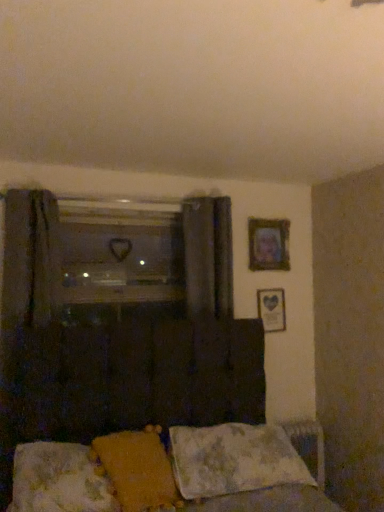
Question: Does yellow fabric pillow at lower center, marked as the 2th pillow in a right-to-left arrangement, have a greater width compared to fluffy white pillow at lower center, which ranks as the 1th pillow in left-to-right order?

Choices:
 (A) no
 (B) yes

Answer: (B)

Question: Does yellow fabric pillow at lower center, placed as the second pillow when sorted from left to right, have a lesser height compared to fluffy white pillow at lower center, which ranks as the 1th pillow in left-to-right order?

Choices:
 (A) no
 (B) yes

Answer: (A)

Question: Is yellow fabric pillow at lower center, marked as the 2th pillow in a right-to-left arrangement, positioned behind fluffy white pillow at lower center, which ranks as the 1th pillow in left-to-right order?

Choices:
 (A) yes
 (B) no

Answer: (A)

Question: Is yellow fabric pillow at lower center, marked as the 2th pillow in a right-to-left arrangement, to the right of fluffy white pillow at lower center, which ranks as the 1th pillow in left-to-right order, from the viewer's perspective?

Choices:
 (A) yes
 (B) no

Answer: (A)

Question: From the image's perspective, does yellow fabric pillow at lower center, placed as the second pillow when sorted from left to right, appear higher than fluffy white pillow at lower center, which ranks as the 3th pillow in right-to-left order?

Choices:
 (A) yes
 (B) no

Answer: (A)

Question: From the image's perspective, is yellow fabric pillow at lower center, placed as the second pillow when sorted from left to right, under fluffy white pillow at lower center, which ranks as the 1th pillow in left-to-right order?

Choices:
 (A) no
 (B) yes

Answer: (A)

Question: Is dark gray fabric curtain at center touching fluffy fabric bed at lower center?

Choices:
 (A) yes
 (B) no

Answer: (B)

Question: Is dark gray fabric curtain at center facing away from fluffy fabric bed at lower center?

Choices:
 (A) yes
 (B) no

Answer: (B)

Question: Considering the relative sizes of dark gray fabric curtain at center and fluffy fabric bed at lower center in the image provided, is dark gray fabric curtain at center bigger than fluffy fabric bed at lower center?

Choices:
 (A) yes
 (B) no

Answer: (B)

Question: From a real-world perspective, is dark gray fabric curtain at center positioned over fluffy fabric bed at lower center based on gravity?

Choices:
 (A) no
 (B) yes

Answer: (B)

Question: Is dark gray fabric curtain at center not inside fluffy fabric bed at lower center?

Choices:
 (A) no
 (B) yes

Answer: (B)

Question: Is dark gray fabric curtain at center at the left side of fluffy fabric bed at lower center?

Choices:
 (A) yes
 (B) no

Answer: (B)

Question: Is wooden framed picture at upper right, which appears as the 1th picture frame when ordered from the bottom, taller than yellow fabric pillow at lower center, placed as the second pillow when sorted from left to right?

Choices:
 (A) yes
 (B) no

Answer: (A)